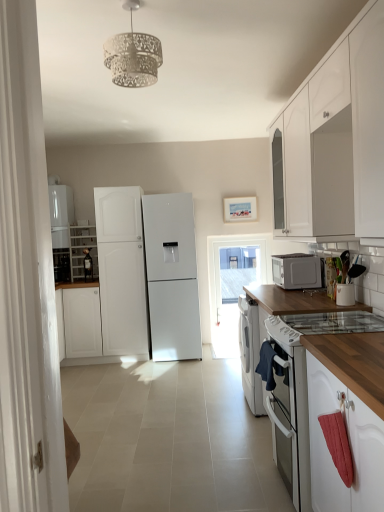
Question: In terms of height, does white wood cabinet at left, acting as the 2th cabinetry starting from the front, look taller or shorter compared to wooden at right?

Choices:
 (A) short
 (B) tall

Answer: (A)

Question: In the image, is white wood cabinet at left, the 1th cabinetry positioned from the left, on the left side or the right side of wooden at right?

Choices:
 (A) left
 (B) right

Answer: (A)

Question: Which of these objects is positioned closest to the white wood cabinet at left, the first cabinetry when ordered from back to front?

Choices:
 (A) white textured lampshade at upper center
 (B) transparent glass door at center
 (C) white glossy cabinet at upper right, which ranks as the second cabinetry in back-to-front order
 (D) white matte refrigerator at left, the 1th refrigerator from the left
 (E) wooden at right

Answer: (D)

Question: Based on their relative distances, which object is nearer to the white matte refrigerator at left, which is the second refrigerator from right to left?

Choices:
 (A) white glass gas stove at lower right
 (B) satin silver microwave at right
 (C) white matte refrigerator at center, positioned as the first refrigerator in right-to-left order
 (D) transparent glass door at center
 (E) wooden at right

Answer: (C)